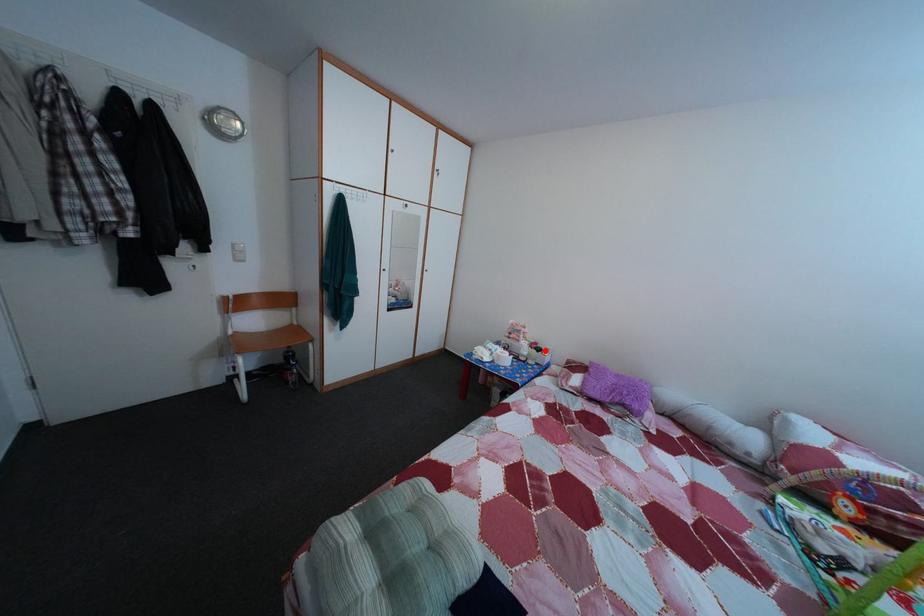
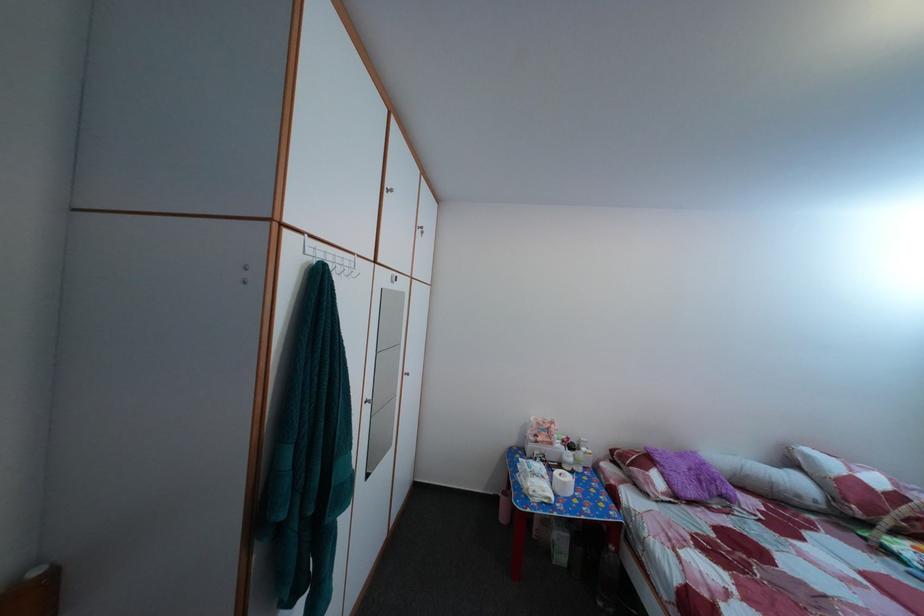
In the second image, find the point that corresponds to the highlighted location in the first image.

(578, 447)